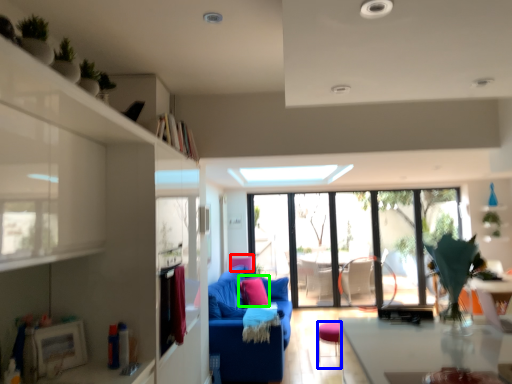
Question: Considering the real-world distances, which object is closest to armchair (highlighted by a red box)? stool (highlighted by a blue box) or pillow (highlighted by a green box).

Choices:
 (A) stool
 (B) pillow

Answer: (B)